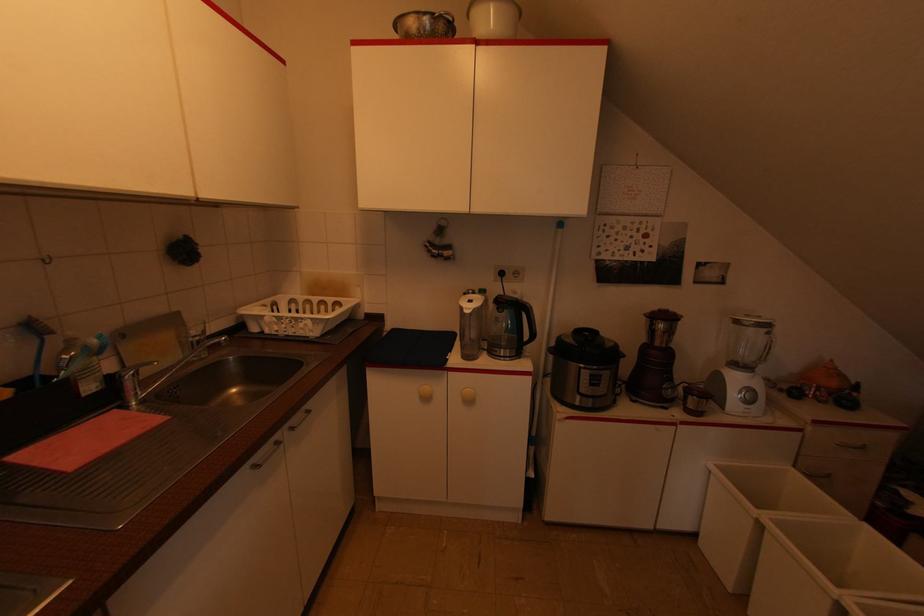
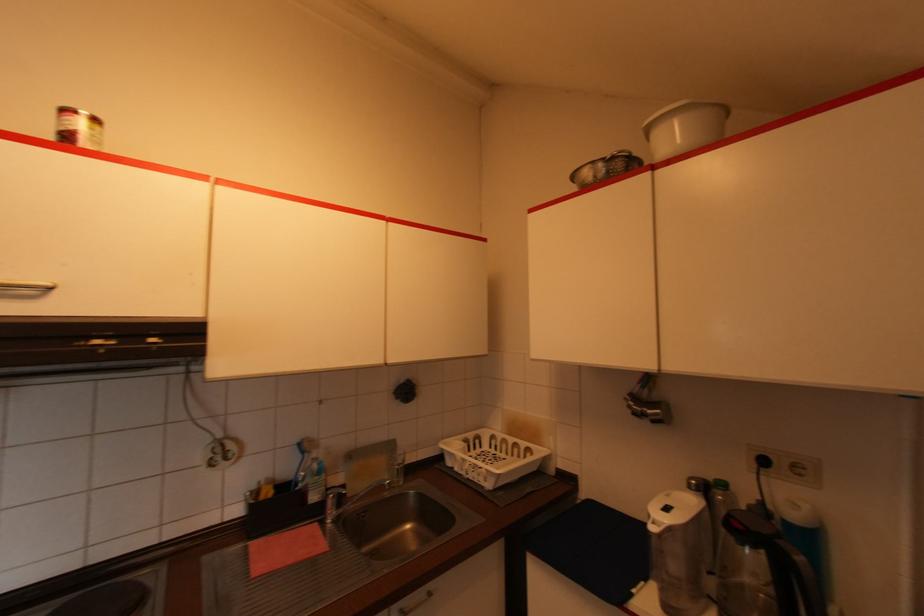
Question: I am providing you with two images of the same scene from different viewpoints. After the viewpoint changes to image2, which objects are now occluded?

Choices:
 (A) white plastic bucket
 (B) black kettle handle
 (C) silver cabinet handle
 (D) none of these

Answer: (D)